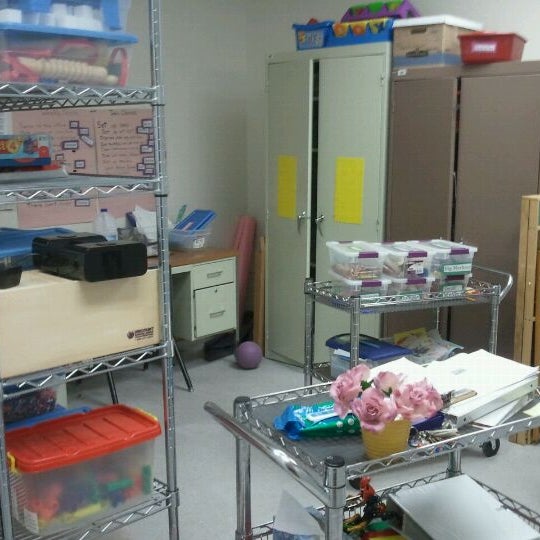
Identify the location of cabinet doors. (300, 121), (339, 121), (420, 147), (464, 147).